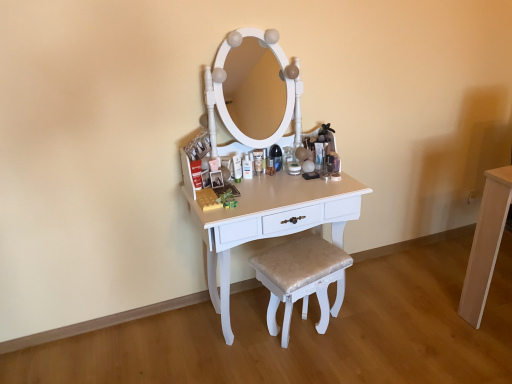
This screenshot has height=384, width=512. Find the location of `vacant space underneath shiny beige cushioned stool at center (from a real-world perspective)`. vacant space underneath shiny beige cushioned stool at center (from a real-world perspective) is located at coordinates (309, 347).